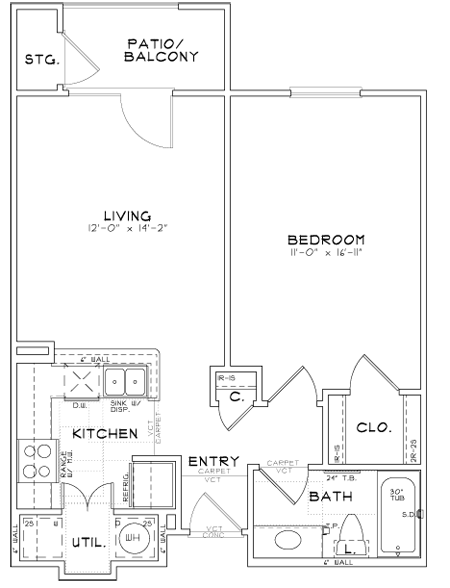
In order to click on sink in this screenshot , I will do `click(295, 544)`, `click(135, 380)`, `click(112, 380)`.